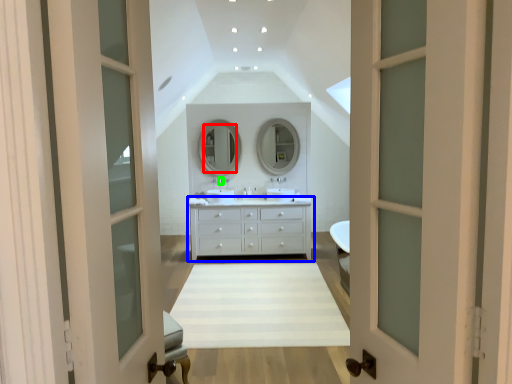
Question: Considering the real-world distances, which object is farthest from mirror (highlighted by a red box)? chest of drawers (highlighted by a blue box) or faucet (highlighted by a green box)?

Choices:
 (A) chest of drawers
 (B) faucet

Answer: (A)